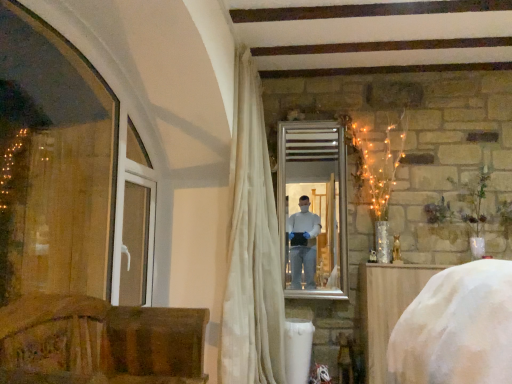
Question: Could you tell me if white plastic window frame at left is turned towards silver/metallic mirror at center?

Choices:
 (A) no
 (B) yes

Answer: (A)

Question: Does white plastic window frame at left have a greater height compared to silver/metallic mirror at center?

Choices:
 (A) no
 (B) yes

Answer: (A)

Question: Would you say white plastic window frame at left is a long distance from silver/metallic mirror at center?

Choices:
 (A) yes
 (B) no

Answer: (A)

Question: Is white plastic window frame at left oriented away from silver/metallic mirror at center?

Choices:
 (A) yes
 (B) no

Answer: (B)

Question: Does white plastic window frame at left lie in front of silver/metallic mirror at center?

Choices:
 (A) no
 (B) yes

Answer: (B)

Question: From a real-world perspective, is white fabric-covered object at lower right, positioned as the second furniture in left-to-right order, above or below silver/metallic mirror at center?

Choices:
 (A) above
 (B) below

Answer: (B)

Question: Considering their positions, is white fabric-covered object at lower right, positioned as the second furniture in left-to-right order, located in front of or behind silver/metallic mirror at center?

Choices:
 (A) front
 (B) behind

Answer: (A)

Question: Choose the correct answer: Is white fabric-covered object at lower right, which is the second furniture in front-to-back order, inside silver/metallic mirror at center or outside it?

Choices:
 (A) outside
 (B) inside

Answer: (A)

Question: In the image, is white fabric-covered object at lower right, which is the second furniture in front-to-back order, on the left side or the right side of silver/metallic mirror at center?

Choices:
 (A) left
 (B) right

Answer: (B)

Question: From the image's perspective, relative to white plastic window frame at left, is white fabric-covered object at lower right, which is counted as the 1th furniture, starting from the right, above or below?

Choices:
 (A) below
 (B) above

Answer: (A)

Question: From their relative heights in the image, would you say white fabric-covered object at lower right, which is counted as the 1th furniture, starting from the right, is taller or shorter than white plastic window frame at left?

Choices:
 (A) short
 (B) tall

Answer: (B)

Question: Relative to white plastic window frame at left, is white fabric-covered object at lower right, the first furniture from the back, in front or behind?

Choices:
 (A) behind
 (B) front

Answer: (A)

Question: Is white fabric-covered object at lower right, the first furniture from the back, to the left or to the right of white plastic window frame at left in the image?

Choices:
 (A) right
 (B) left

Answer: (A)

Question: Based on their positions, is wooden chair at lower left, positioned as the second furniture in right-to-left order, located to the left or right of silver/metallic mirror at center?

Choices:
 (A) right
 (B) left

Answer: (B)

Question: In terms of height, does wooden chair at lower left, which is the 1th furniture in front-to-back order, look taller or shorter compared to silver/metallic mirror at center?

Choices:
 (A) short
 (B) tall

Answer: (A)